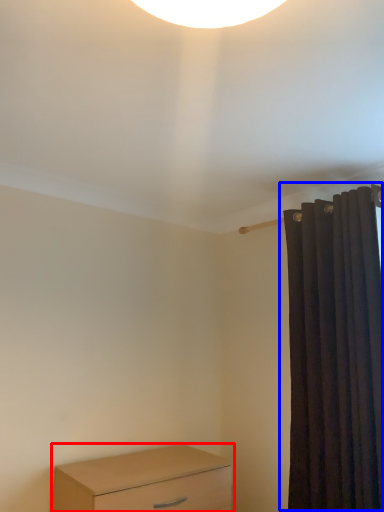
Question: Which object is closer to the camera taking this photo, chest of drawers (highlighted by a red box) or curtain (highlighted by a blue box)?

Choices:
 (A) chest of drawers
 (B) curtain

Answer: (B)